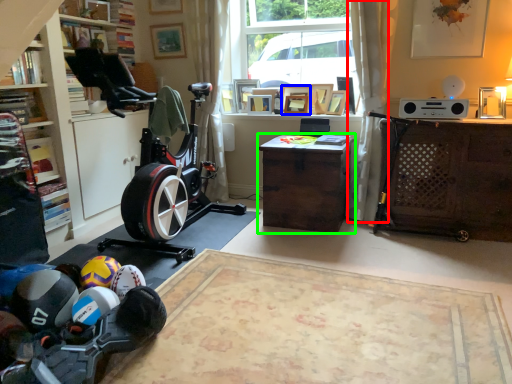
Question: Estimate the real-world distances between objects in this image. Which object is farther from curtain (highlighted by a red box), picture frame (highlighted by a blue box) or desk (highlighted by a green box)?

Choices:
 (A) picture frame
 (B) desk

Answer: (A)